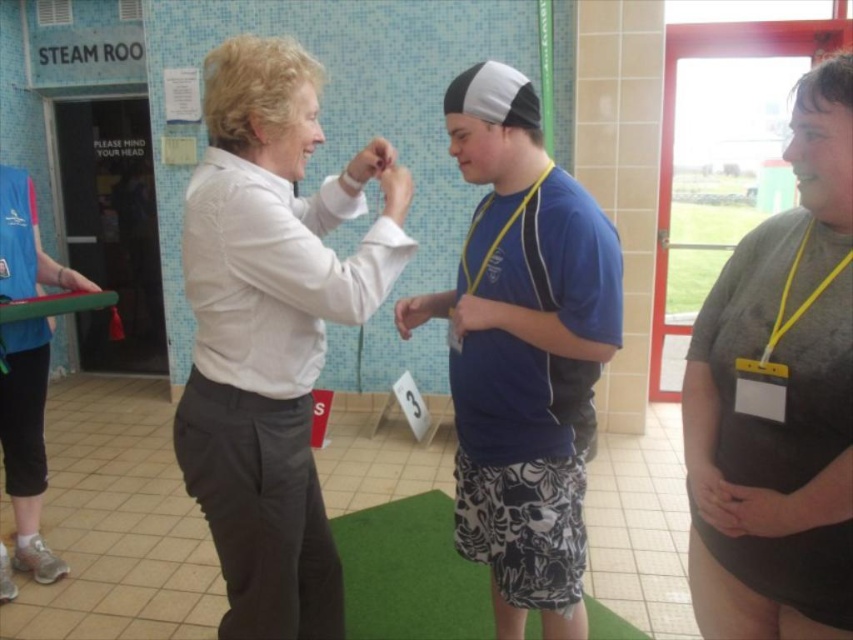
Question: Which point is farther to the camera?

Choices:
 (A) (801, 419)
 (B) (590, 250)
 (C) (242, 531)

Answer: (C)

Question: Does blue fabric shirt at center appear on the left side of gray matte t-shirt at center?

Choices:
 (A) no
 (B) yes

Answer: (B)

Question: Estimate the real-world distances between objects in this image. Which object is farther from the white smooth shirt at center?

Choices:
 (A) blue fabric shirt at center
 (B) gray matte t-shirt at center

Answer: (B)

Question: Observing the image, what is the correct spatial positioning of white smooth shirt at center in reference to blue fabric shirt at center?

Choices:
 (A) right
 (B) left

Answer: (B)

Question: Does white smooth shirt at center have a lesser width compared to gray matte t-shirt at center?

Choices:
 (A) no
 (B) yes

Answer: (A)

Question: Which object is the closest to the blue fabric shirt at center?

Choices:
 (A) white smooth shirt at center
 (B) gray matte t-shirt at center

Answer: (A)